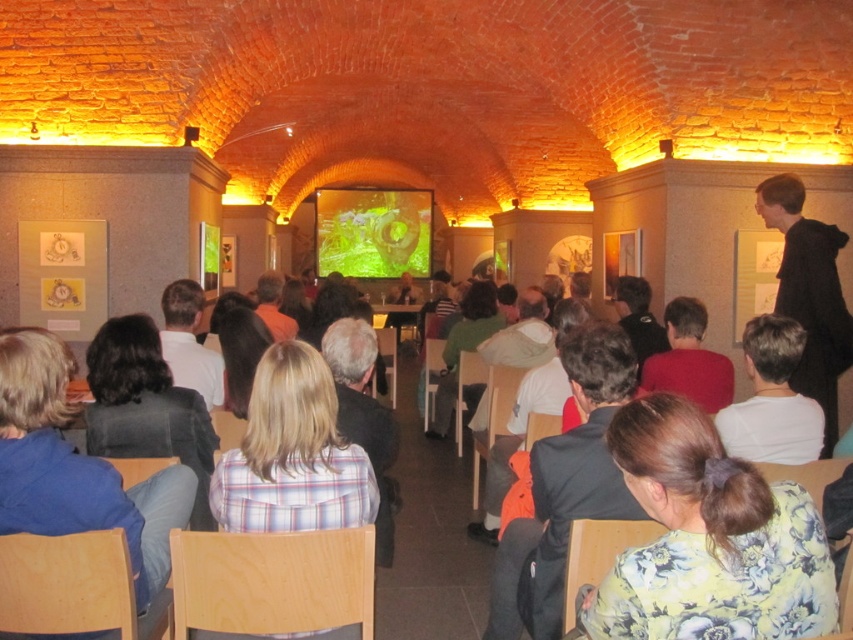
Is dark brown leather jacket at lower left bigger than black hoodie at right?

No.

Between dark brown leather jacket at lower left and black hoodie at right, which one appears on the right side from the viewer's perspective?

black hoodie at right

Which is in front, point (97, 328) or point (828, 288)?

Point (828, 288) is more forward.

Locate an element on the screen. dark brown leather jacket at lower left is located at coordinates [146, 406].

Is dark brown hair at center wider than blonde hair at center?

No.

Who is shorter, dark brown hair at center or blonde hair at center?

Standing shorter between the two is blonde hair at center.

Is point (657, 330) positioned after point (260, 301)?

No, it is not.

Locate an element on the screen. The width and height of the screenshot is (853, 640). dark brown hair at center is located at coordinates (637, 317).

This screenshot has width=853, height=640. Find the location of `red matte shirt at center`. red matte shirt at center is located at coordinates point(688,358).

Looking at this image, can you confirm if red matte shirt at center is positioned above green fabric shirt at center?

No, red matte shirt at center is not above green fabric shirt at center.

Where is `red matte shirt at center`? The width and height of the screenshot is (853, 640). red matte shirt at center is located at coordinates (688, 358).